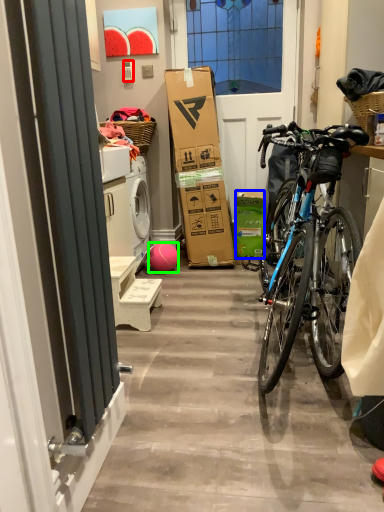
Question: Which object is positioned farthest from power outlet (highlighted by a red box)? Select from box (highlighted by a blue box) and ball (highlighted by a green box).

Choices:
 (A) box
 (B) ball

Answer: (A)